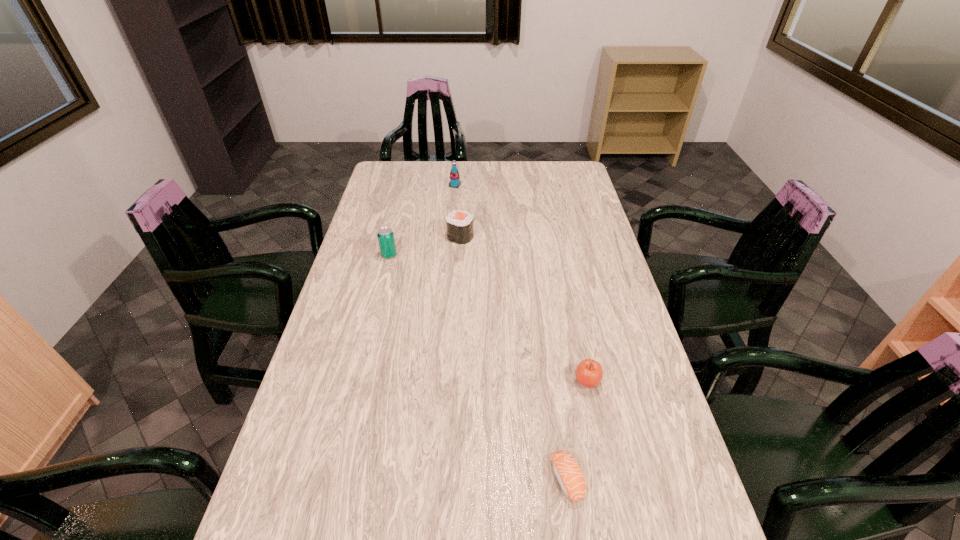
Where is `free area in between the taller sushi and the leftmost object`? free area in between the taller sushi and the leftmost object is located at coordinates (424, 246).

This screenshot has height=540, width=960. In order to click on object identified as the third closest to the third farthest object in this screenshot , I will do `click(589, 373)`.

This screenshot has height=540, width=960. Identify the location of object that stands as the third closest to the shorter sushi. (385, 235).

Identify the location of free space that satisfies the following two spatial constraints: 1. on the front side of the leftmost object; 2. on the right side of the fourth object from left to right. This screenshot has height=540, width=960. (335, 479).

You are a GUI agent. You are given a task and a screenshot of the screen. Output one action in this format:
    pyautogui.click(x=<x>, y=<y>)
    Task: Click on the free spot that satisfies the following two spatial constraints: 1. on the front side of the third nearest object; 2. on the left side of the rightmost object
    
    Given the screenshot: What is the action you would take?
    pyautogui.click(x=358, y=382)